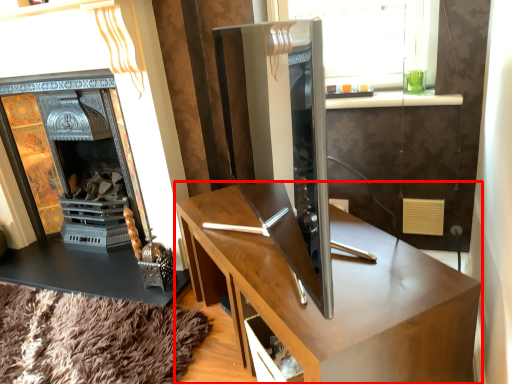
Question: From the image's perspective, where is desk (annotated by the red box) located relative to fireplace?

Choices:
 (A) above
 (B) below

Answer: (B)